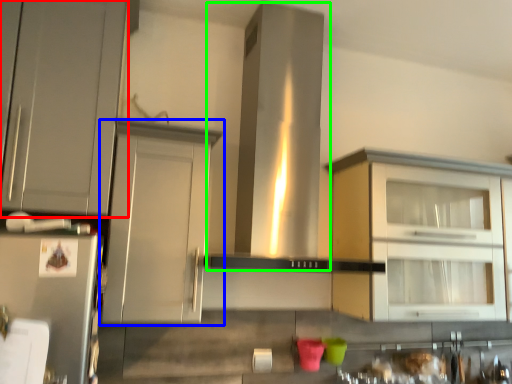
Question: Which is nearer to the cabinetry (highlighted by a red box)? cabinetry (highlighted by a blue box) or vent (highlighted by a green box).

Choices:
 (A) cabinetry
 (B) vent

Answer: (A)